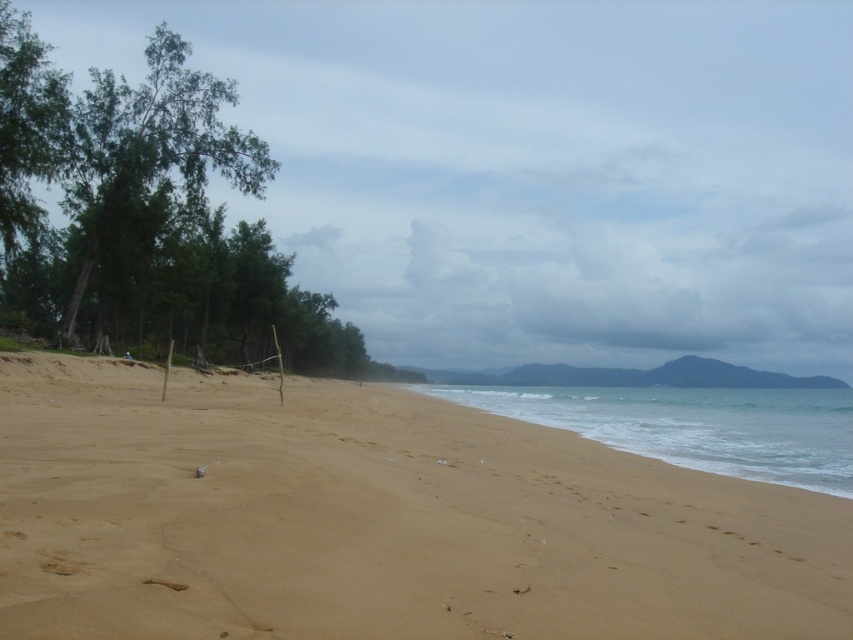
Question: Does sandy beach at lower left lie in front of brown sandy footprint at lower center?

Choices:
 (A) yes
 (B) no

Answer: (A)

Question: Is sandy beach at lower left to the right of green leafy tree at left from the viewer's perspective?

Choices:
 (A) yes
 (B) no

Answer: (A)

Question: Which point is farther from the camera taking this photo?

Choices:
 (A) (157, 579)
 (B) (201, 205)
 (C) (440, 509)

Answer: (B)

Question: Does sandy beach at lower left come in front of brown sandy footprint at lower center?

Choices:
 (A) no
 (B) yes

Answer: (B)

Question: Which of the following is the closest to the observer?

Choices:
 (A) brown sandy footprint at lower center
 (B) clear water at lower center

Answer: (A)

Question: Among these objects, which one is farthest from the camera?

Choices:
 (A) green leafy tree at left
 (B) brown sandy footprint at lower center
 (C) clear water at lower center
 (D) sandy beach at lower left

Answer: (A)